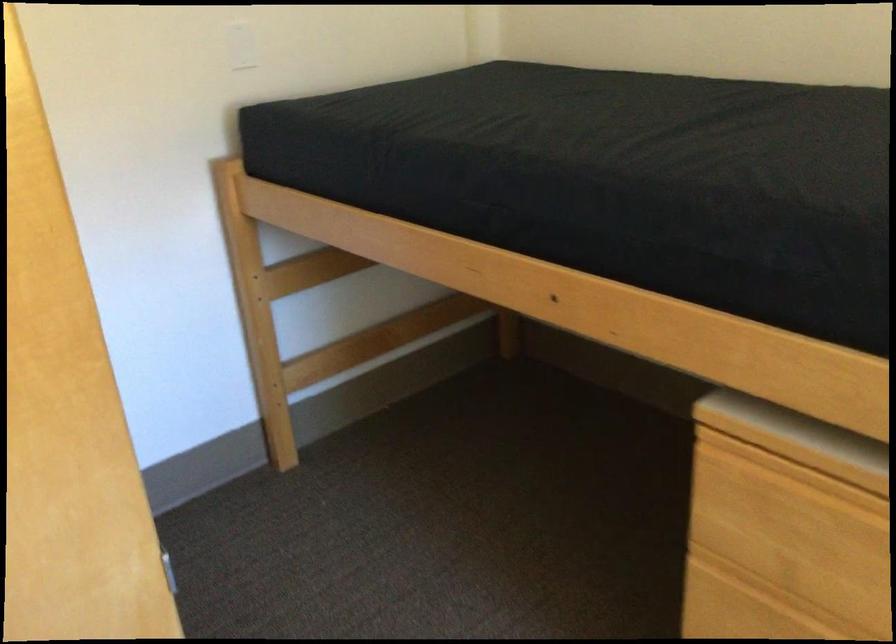
The image size is (896, 644). Identify the location of light switch. (239, 44).